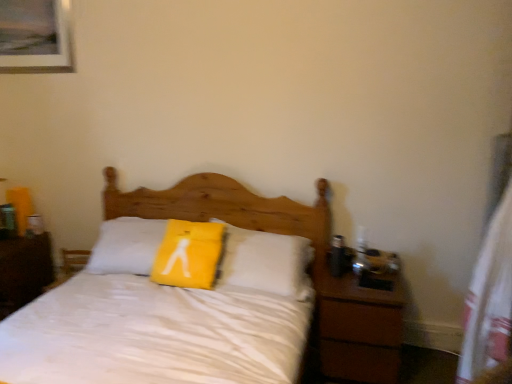
Question: Is yellow fabric pillow at center bigger or smaller than wooden picture frame at upper left?

Choices:
 (A) small
 (B) big

Answer: (B)

Question: In terms of height, does yellow fabric pillow at center look taller or shorter compared to wooden picture frame at upper left?

Choices:
 (A) tall
 (B) short

Answer: (A)

Question: Based on their relative distances, which object is nearer to the wooden picture frame at upper left?

Choices:
 (A) yellow fabric pillow at center
 (B) brown wood nightstand at left, which is the 1th nightstand from left to right
 (C) brown wooden nightstand at right, which is the second nightstand from left to right
 (D) white matte bed at center

Answer: (D)

Question: Considering the real-world distances, which object is farthest from the brown wooden nightstand at right, placed as the 1th nightstand when sorted from right to left?

Choices:
 (A) yellow fabric pillow at center
 (B) brown wood nightstand at left, which is the 1th nightstand from left to right
 (C) white matte bed at center
 (D) wooden picture frame at upper left

Answer: (D)